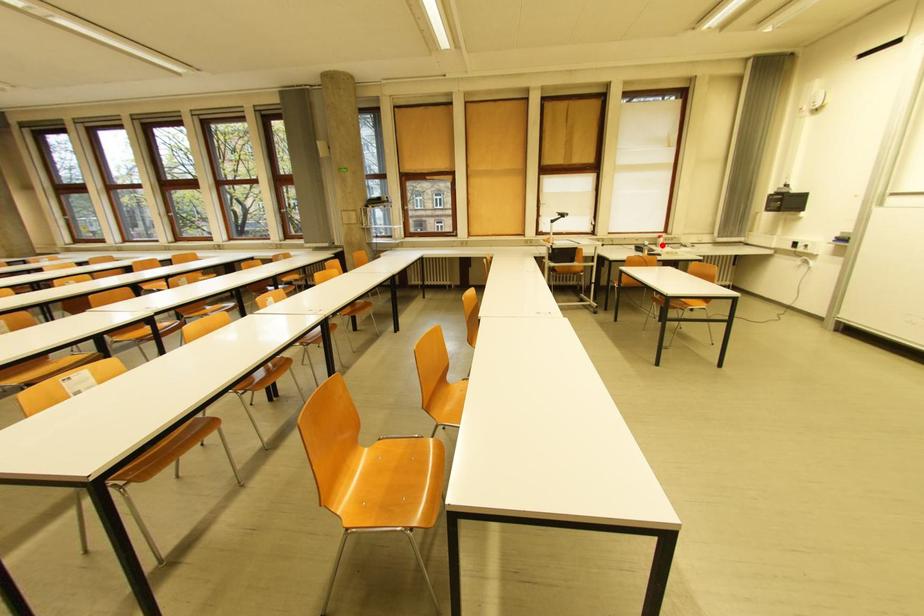
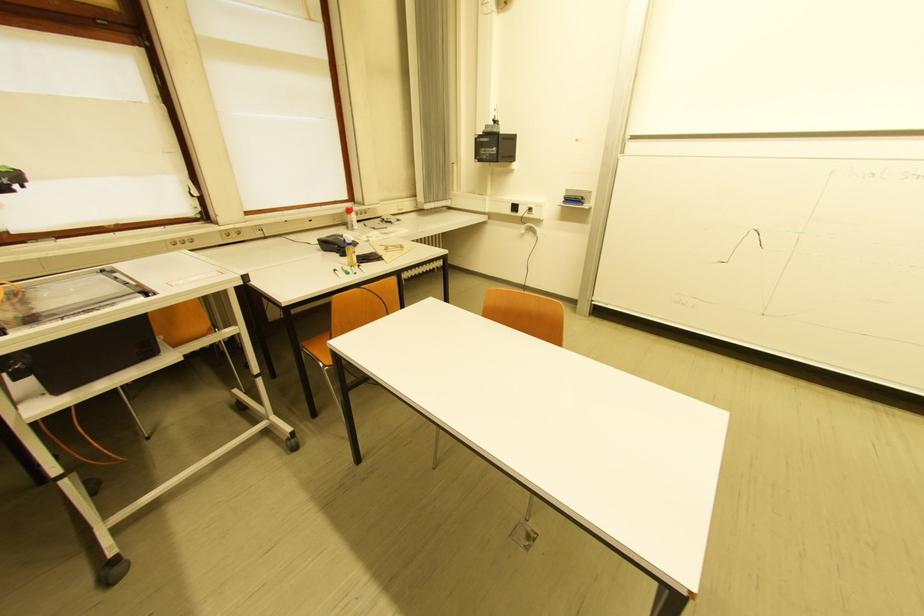
Locate, in the second image, the point that corresponds to the highlighted location in the first image.

(351, 225)